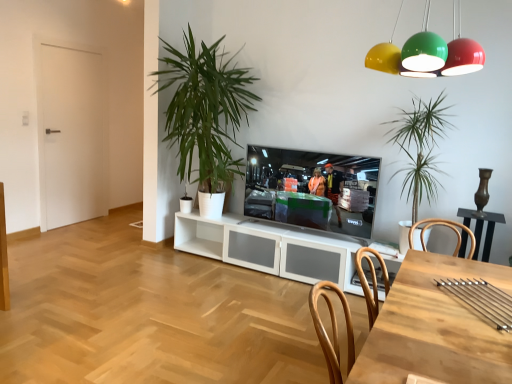
The height and width of the screenshot is (384, 512). What do you see at coordinates (428, 53) in the screenshot?
I see `metallic dome lights at upper center` at bounding box center [428, 53].

I want to click on matte black television at center, so click(x=311, y=189).

The height and width of the screenshot is (384, 512). What do you see at coordinates (71, 135) in the screenshot?
I see `white matte door at left` at bounding box center [71, 135].

In order to face wooden table at lower right, should I rotate leftwards or rightwards?

It's best to rotate right around 24.825 degrees.

This screenshot has width=512, height=384. I want to click on metallic dome lights at upper center, so click(x=428, y=53).

From the image's perspective, which is below, white matte door at left or wooden table at lower right?

wooden table at lower right.

Is point (63, 162) positioned after point (371, 343)?

Yes.

Is white matte door at left positioned behind wooden table at lower right?

Yes, white matte door at left is further from the camera.

Which of these two, green leafy plant at center, the first houseplant positioned from the left, or green leafy plant at center, placed as the 1th houseplant when sorted from right to left, is smaller?

With smaller size is green leafy plant at center, placed as the 1th houseplant when sorted from right to left.

The width and height of the screenshot is (512, 384). I want to click on houseplant lying below the green leafy plant at center, the second houseplant when ordered from right to left (from the image's perspective), so click(420, 148).

In the scene shown: From a real-world perspective, is green leafy plant at center, the first houseplant positioned from the left, positioned above or below green leafy plant at center, which ranks as the second houseplant in left-to-right order?

green leafy plant at center, the first houseplant positioned from the left, is situated higher than green leafy plant at center, which ranks as the second houseplant in left-to-right order, in the real world.

Can you confirm if wooden table at lower right is shorter than green leafy plant at center, placed as the 1th houseplant when sorted from right to left?

Correct, wooden table at lower right is not as tall as green leafy plant at center, placed as the 1th houseplant when sorted from right to left.

Is wooden table at lower right situated inside green leafy plant at center, which ranks as the second houseplant in left-to-right order, or outside?

wooden table at lower right is outside green leafy plant at center, which ranks as the second houseplant in left-to-right order.

Visually, is wooden table at lower right positioned to the left or to the right of green leafy plant at center, placed as the 1th houseplant when sorted from right to left?

From the image, it's evident that wooden table at lower right is to the left of green leafy plant at center, placed as the 1th houseplant when sorted from right to left.

From a real-world perspective, which is physically below, wooden table at lower right or green leafy plant at center, placed as the 1th houseplant when sorted from right to left?

wooden table at lower right.

Is green leafy plant at center, placed as the 1th houseplant when sorted from right to left, located outside wooden table at lower right?

Yes.

At what (x,y) coordinates should I click in order to perform the action: click on the 1st houseplant behind the wooden table at lower right, starting your count from the anchor. Please return your answer as a coordinate pair (x, y). This screenshot has height=384, width=512. Looking at the image, I should click on (420, 148).

Considering the relative sizes of green leafy plant at center, which ranks as the second houseplant in left-to-right order, and wooden table at lower right in the image provided, is green leafy plant at center, which ranks as the second houseplant in left-to-right order, shorter than wooden table at lower right?

In fact, green leafy plant at center, which ranks as the second houseplant in left-to-right order, may be taller than wooden table at lower right.

From the image's perspective, which one is positioned higher, green leafy plant at center, which ranks as the second houseplant in left-to-right order, or wooden table at lower right?

green leafy plant at center, which ranks as the second houseplant in left-to-right order.

From the picture: Is wooden table at lower right thinner than matte black television at center?

In fact, wooden table at lower right might be wider than matte black television at center.

Consider the image. From the image's perspective, who appears lower, wooden table at lower right or matte black television at center?

wooden table at lower right is shown below in the image.

Which is more distant, (470, 316) or (330, 182)?

The point (330, 182) is behind.

In the image, there is a matte black television at center. At what (x,y) coordinates should I click in order to perform the action: click on desk below it (from a real-world perspective). Please return your answer as a coordinate pair (x, y). Looking at the image, I should click on (435, 328).

Where is `door that is behind the metallic dome lights at upper center`? The height and width of the screenshot is (384, 512). door that is behind the metallic dome lights at upper center is located at coordinates coord(71,135).

Is white matte door at left far from metallic dome lights at upper center?

Yes.

Considering the relative sizes of white matte door at left and metallic dome lights at upper center in the image provided, is white matte door at left thinner than metallic dome lights at upper center?

Indeed, white matte door at left has a lesser width compared to metallic dome lights at upper center.

Consider the image. Considering the relative positions of white matte door at left and metallic dome lights at upper center in the image provided, is white matte door at left to the right of metallic dome lights at upper center from the viewer's perspective?

In fact, white matte door at left is to the left of metallic dome lights at upper center.

Is green leafy plant at center, the first houseplant positioned from the left, situated inside white matte door at left or outside?

green leafy plant at center, the first houseplant positioned from the left, is outside white matte door at left.

Between green leafy plant at center, the second houseplant when ordered from right to left, and white matte door at left, which one appears on the right side from the viewer's perspective?

green leafy plant at center, the second houseplant when ordered from right to left, is more to the right.

Between green leafy plant at center, the first houseplant positioned from the left, and white matte door at left, which one has less height?

green leafy plant at center, the first houseplant positioned from the left.

Does green leafy plant at center, the second houseplant when ordered from right to left, have a greater width compared to white matte door at left?

Yes, green leafy plant at center, the second houseplant when ordered from right to left, is wider than white matte door at left.

What are the coordinates of `door that is behind the wooden table at lower right` in the screenshot? It's located at (71, 135).

The height and width of the screenshot is (384, 512). In order to click on houseplant below the green leafy plant at center, the first houseplant positioned from the left (from the image's perspective) in this screenshot , I will do `click(420, 148)`.

From the image, which object appears to be farther from matte black television at center, white matte door at left or wooden table at lower right?

white matte door at left is positioned further to the anchor matte black television at center.

Based on the photo, looking at the image, which one is located further to white matte door at left, matte black television at center or wooden table at lower right?

wooden table at lower right.

Considering their positions, is white matte door at left positioned closer to green leafy plant at center, which ranks as the second houseplant in left-to-right order, than wooden table at lower right?

Based on the image, wooden table at lower right appears to be nearer to green leafy plant at center, which ranks as the second houseplant in left-to-right order.

Looking at the image, which one is located closer to wooden table at lower right, metallic dome lights at upper center or green leafy plant at center, the second houseplant when ordered from right to left?

Among the two, metallic dome lights at upper center is located nearer to wooden table at lower right.

Based on their spatial positions, is wooden table at lower right or metallic dome lights at upper center further from green leafy plant at center, the second houseplant when ordered from right to left?

wooden table at lower right is further to green leafy plant at center, the second houseplant when ordered from right to left.

Estimate the real-world distances between objects in this image. Which object is further from green leafy plant at center, placed as the 1th houseplant when sorted from right to left, wooden table at lower right or metallic dome lights at upper center?

wooden table at lower right.

Considering their positions, is green leafy plant at center, the second houseplant when ordered from right to left, positioned closer to matte black television at center than wooden table at lower right?

The object closer to matte black television at center is green leafy plant at center, the second houseplant when ordered from right to left.

Estimate the real-world distances between objects in this image. Which object is closer to green leafy plant at center, which ranks as the second houseplant in left-to-right order, green leafy plant at center, the first houseplant positioned from the left, or metallic dome lights at upper center?

Based on the image, metallic dome lights at upper center appears to be nearer to green leafy plant at center, which ranks as the second houseplant in left-to-right order.

The image size is (512, 384). I want to click on light fixture positioned between wooden table at lower right and green leafy plant at center, the first houseplant positioned from the left, from near to far, so click(428, 53).

Where is `light fixture located between wooden table at lower right and white matte door at left in the depth direction`? light fixture located between wooden table at lower right and white matte door at left in the depth direction is located at coordinates (428, 53).

You are a GUI agent. You are given a task and a screenshot of the screen. Output one action in this format:
    pyautogui.click(x=<x>, y=<y>)
    Task: Click on the television between wooden table at lower right and white matte door at left from front to back
    
    Given the screenshot: What is the action you would take?
    pyautogui.click(x=311, y=189)

Identify the location of houseplant between white matte door at left and matte black television at center in the horizontal direction. (205, 108).